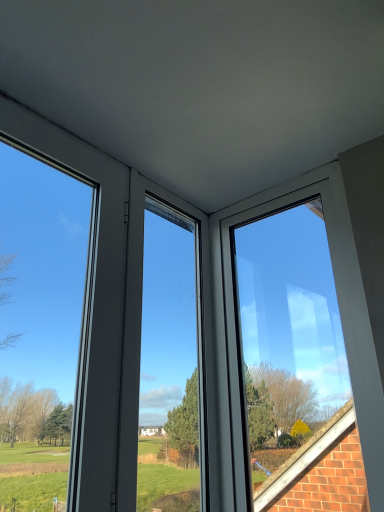
Question: Is transparent glass window at upper right, the 2th window when ordered from left to right, facing towards transparent glass window at left, the first window positioned from the left?

Choices:
 (A) yes
 (B) no

Answer: (A)

Question: Considering the relative sizes of transparent glass window at upper right, the 2th window when ordered from left to right, and transparent glass window at left, marked as the second window in a right-to-left arrangement, in the image provided, is transparent glass window at upper right, the 2th window when ordered from left to right, wider than transparent glass window at left, marked as the second window in a right-to-left arrangement,?

Choices:
 (A) no
 (B) yes

Answer: (B)

Question: Is transparent glass window at upper right, marked as the 1th window in a right-to-left arrangement, taller than transparent glass window at left, the first window positioned from the left?

Choices:
 (A) yes
 (B) no

Answer: (A)

Question: From the image's perspective, does transparent glass window at upper right, marked as the 1th window in a right-to-left arrangement, appear lower than transparent glass window at left, marked as the second window in a right-to-left arrangement?

Choices:
 (A) yes
 (B) no

Answer: (A)

Question: Is transparent glass window at upper right, marked as the 1th window in a right-to-left arrangement, further to the viewer compared to transparent glass window at left, marked as the second window in a right-to-left arrangement?

Choices:
 (A) yes
 (B) no

Answer: (A)

Question: Does transparent glass window at upper right, the 2th window when ordered from left to right, have a larger size compared to transparent glass window at left, the first window positioned from the left?

Choices:
 (A) yes
 (B) no

Answer: (A)

Question: Is transparent glass window at left, marked as the second window in a right-to-left arrangement, at the left side of transparent glass window at upper right, the 2th window when ordered from left to right?

Choices:
 (A) no
 (B) yes

Answer: (B)

Question: Is transparent glass window at left, marked as the second window in a right-to-left arrangement, far from transparent glass window at upper right, marked as the 1th window in a right-to-left arrangement?

Choices:
 (A) no
 (B) yes

Answer: (A)

Question: From the image's perspective, does transparent glass window at left, the first window positioned from the left, appear higher than transparent glass window at upper right, marked as the 1th window in a right-to-left arrangement?

Choices:
 (A) no
 (B) yes

Answer: (B)

Question: Considering the relative sizes of transparent glass window at left, marked as the second window in a right-to-left arrangement, and transparent glass window at upper right, marked as the 1th window in a right-to-left arrangement, in the image provided, is transparent glass window at left, marked as the second window in a right-to-left arrangement, thinner than transparent glass window at upper right, marked as the 1th window in a right-to-left arrangement,?

Choices:
 (A) no
 (B) yes

Answer: (B)

Question: Is transparent glass window at left, marked as the second window in a right-to-left arrangement, placed right next to transparent glass window at upper right, marked as the 1th window in a right-to-left arrangement?

Choices:
 (A) yes
 (B) no

Answer: (B)

Question: Can we say transparent glass window at left, marked as the second window in a right-to-left arrangement, lies outside transparent glass window at upper right, the 2th window when ordered from left to right?

Choices:
 (A) no
 (B) yes

Answer: (B)

Question: Is transparent glass window at left, the first window positioned from the left, wider or thinner than transparent glass window at upper right, marked as the 1th window in a right-to-left arrangement?

Choices:
 (A) thin
 (B) wide

Answer: (A)